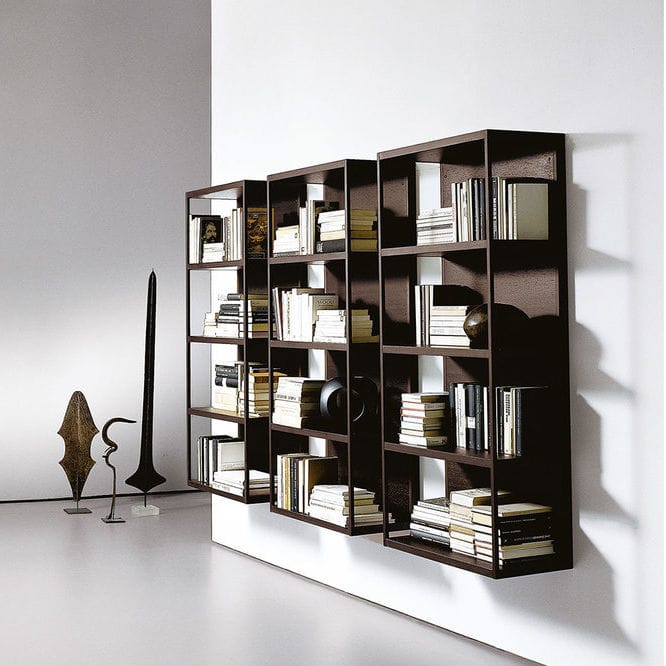
Locate an element on the screen. The height and width of the screenshot is (666, 666). 3 bookshelves is located at coordinates (228, 314), (333, 314), (475, 314), (216, 359), (320, 397), (469, 441).